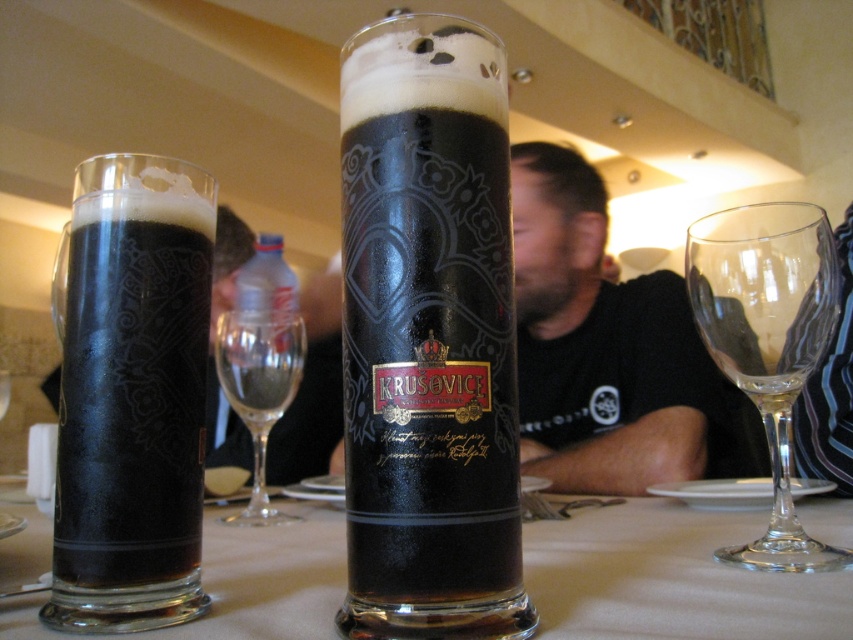
You are a bartender who needs to serve two customers. The dark glass beer at left and the transparent glass at right are on the same table. Which glass is easier to grab quickly without moving your hand much?

The dark glass beer at left is closer to the viewer than the transparent glass at right, so it is easier to grab quickly without moving your hand much.

You are at a bar and want to order a drink. You see two glasses on the table, a dark glass beer at left and a transparent glass at right. Which glass is more to the left?

The dark glass beer at left is more to the left side than the transparent glass at right.